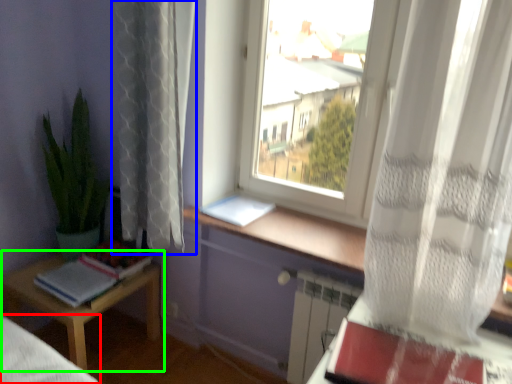
Question: Considering the real-world distances, which object is closest to bed frame (highlighted by a red box)? curtain (highlighted by a blue box) or table (highlighted by a green box).

Choices:
 (A) curtain
 (B) table

Answer: (B)